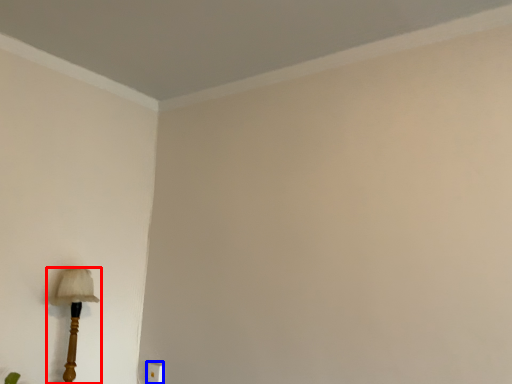
Question: Which point is further to the camera, lamp (highlighted by a red box) or electric outlet (highlighted by a blue box)?

Choices:
 (A) lamp
 (B) electric outlet

Answer: (B)